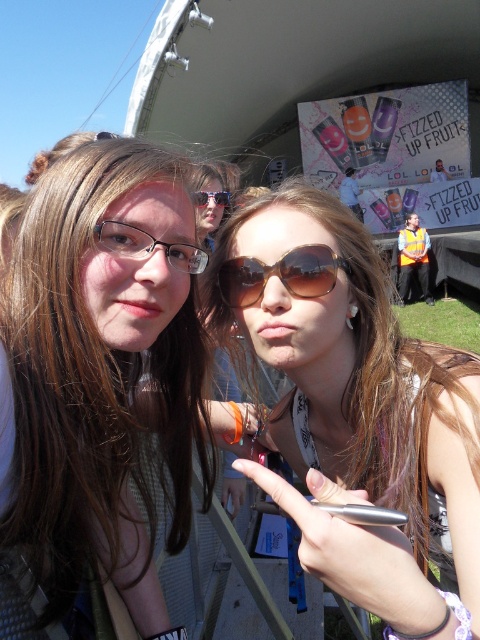
You are a photographer trying to capture a candid shot of the two people in the scene. You notice the brown matte sunglasses at center and the yellow reflective vest at center. Which object is positioned to the left of the other?

The brown matte sunglasses at center is to the left of the yellow reflective vest at center.

You are a photographer trying to capture both the matte black glasses at left and the yellow reflective vest at center in a single frame. Given their sizes, which object should you focus on to ensure both fit in the photo without cropping?

Since the matte black glasses at left has a lesser width compared to the yellow reflective vest at center, you should focus on the yellow reflective vest at center to ensure both objects fit in the frame without cropping.

You are trying to locate the brown matte sunglasses at center in the image. According to the coordinates provided, where exactly would you look?

The brown matte sunglasses at center can be found at the coordinates point (356,408).